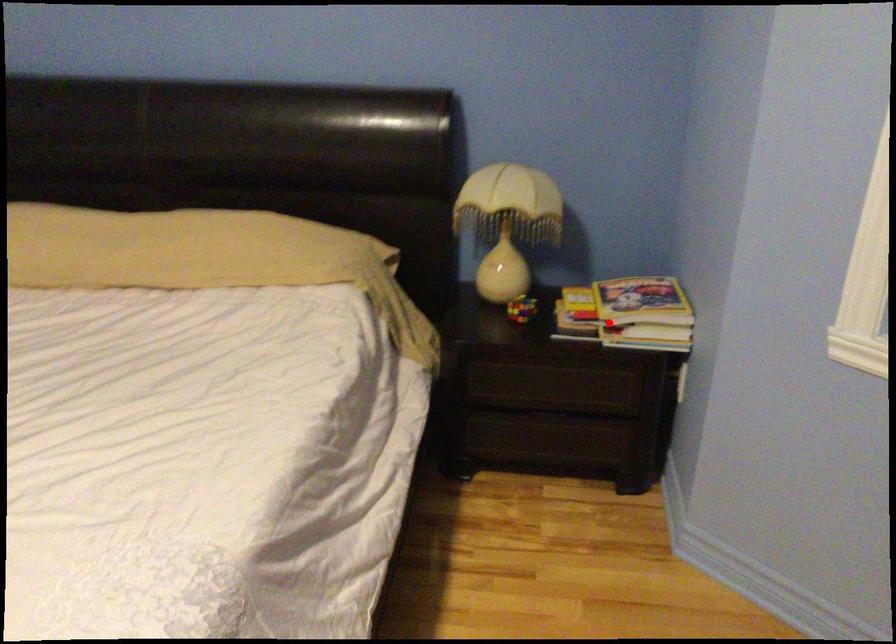
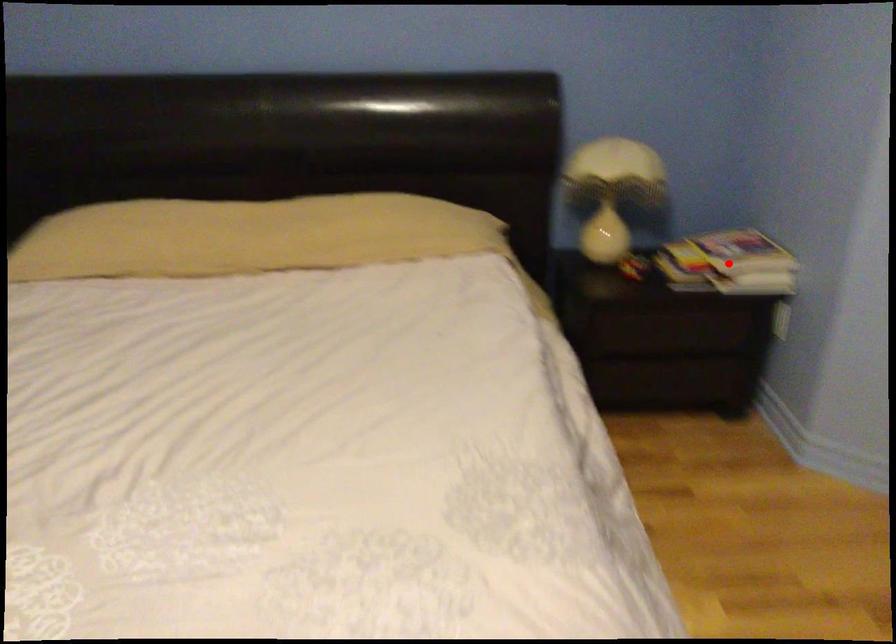
I am providing you with two images of the same scene from different viewpoints. A red point is marked on the first image and another point is marked on the second image. Is the marked point in image1 the same physical position as the marked point in image2?

Yes